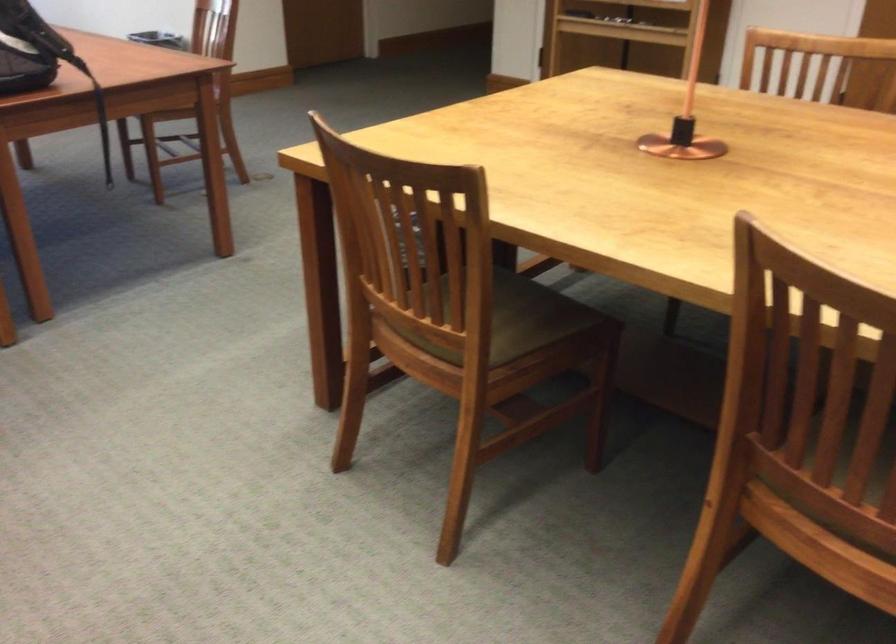
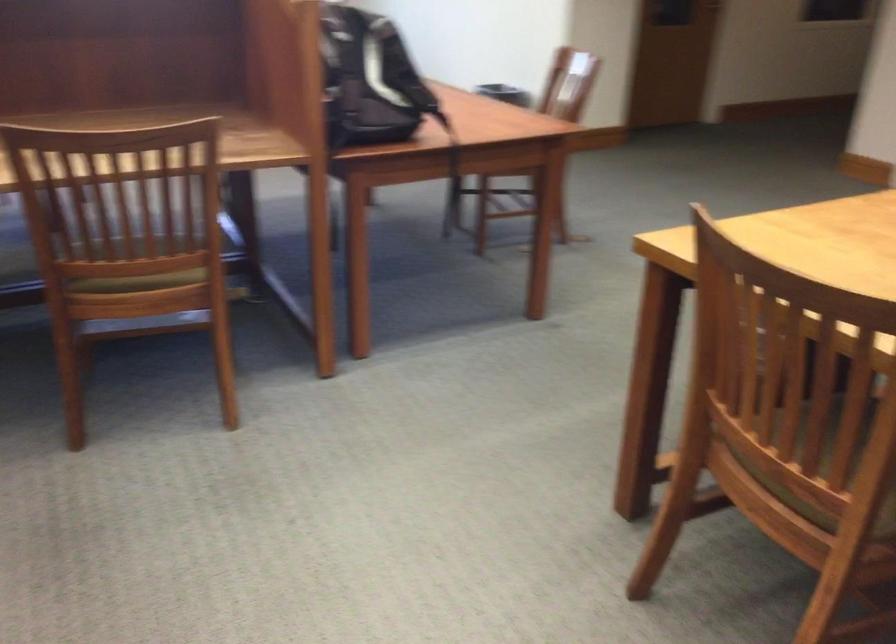
Find the pixel in the second image that matches (454,327) in the first image.

(823, 469)